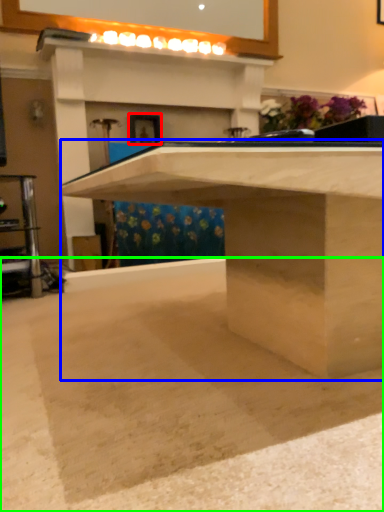
Question: Which object is the farthest from picture frame (highlighted by a red box)? Choose among these: table (highlighted by a blue box) or concrete (highlighted by a green box).

Choices:
 (A) table
 (B) concrete

Answer: (B)